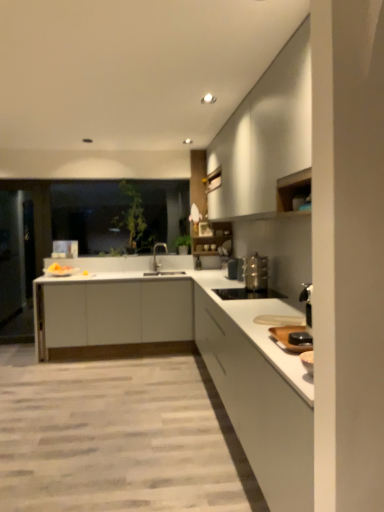
Identify the location of vacant space situated above white matte countertop at center (from a real-world perspective). The width and height of the screenshot is (384, 512). (86, 401).